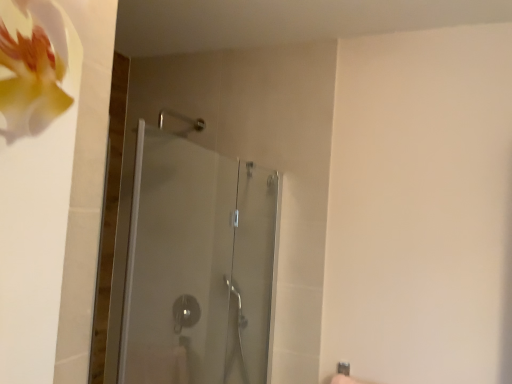
This screenshot has width=512, height=384. What do you see at coordinates (198, 266) in the screenshot? I see `transparent glass shower door at center` at bounding box center [198, 266].

What are the coordinates of `transparent glass shower door at center` in the screenshot? It's located at (198, 266).

Find the location of a particular element. The image size is (512, 384). transparent glass shower door at center is located at coordinates (198, 266).